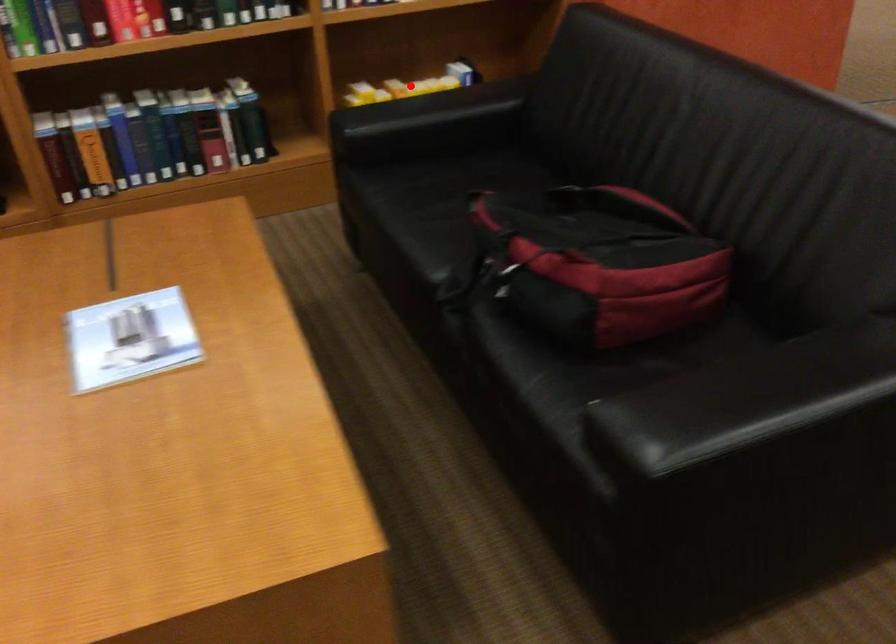
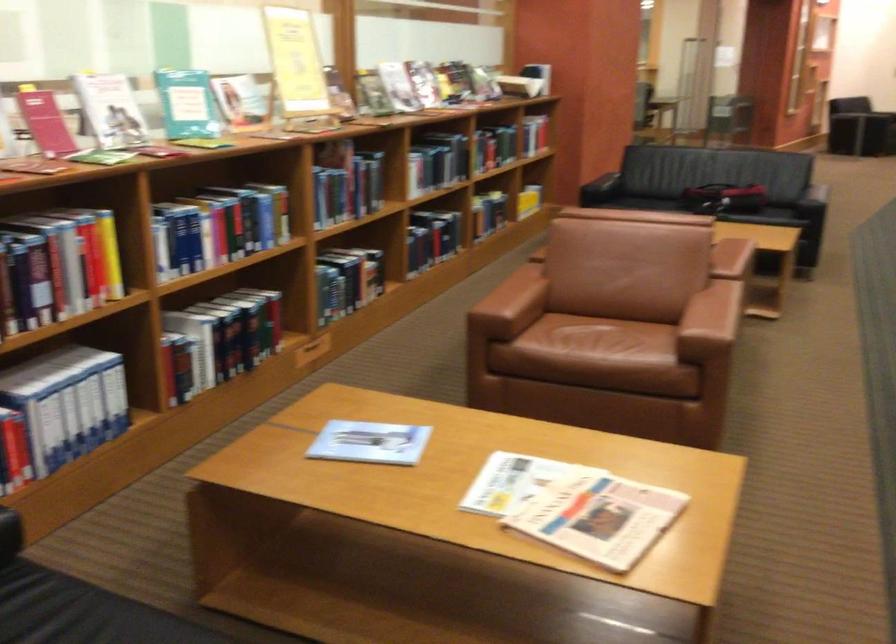
The point at the highlighted location is marked in the first image. Where is the corresponding point in the second image?

(537, 184)